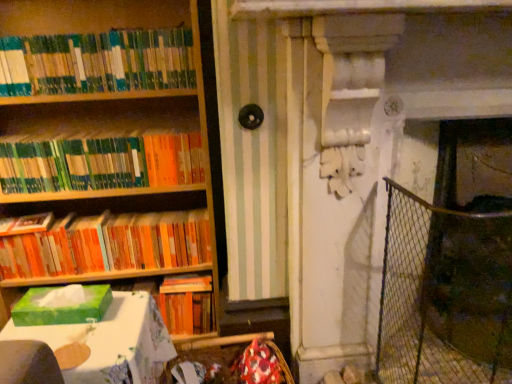
Locate an element on the screen. This screenshot has height=384, width=512. free space above orange matte bookshelf at left, which ranks as the 3th book in top-to-bottom order (from a real-world perspective) is located at coordinates (105, 210).